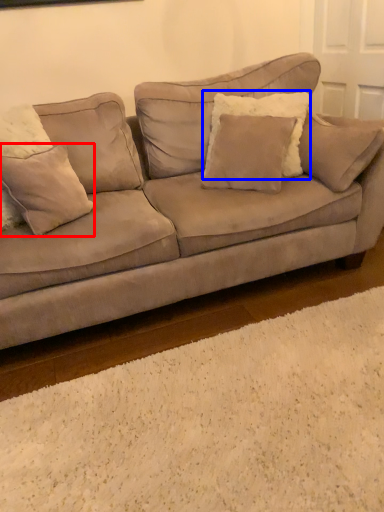
Question: Which object appears farthest to the camera in this image, pillow (highlighted by a red box) or pillow (highlighted by a blue box)?

Choices:
 (A) pillow
 (B) pillow

Answer: (B)